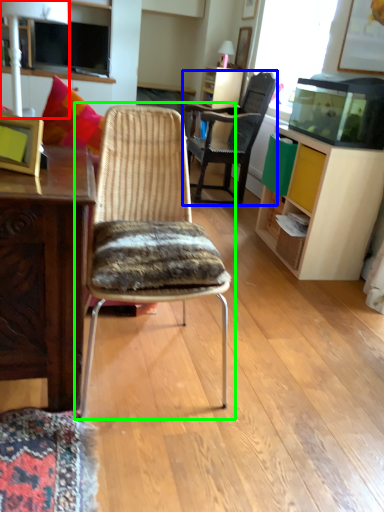
Question: Which object is the closest to the lamp (highlighted by a red box)? Choose among these: chair (highlighted by a blue box) or chair (highlighted by a green box).

Choices:
 (A) chair
 (B) chair

Answer: (A)